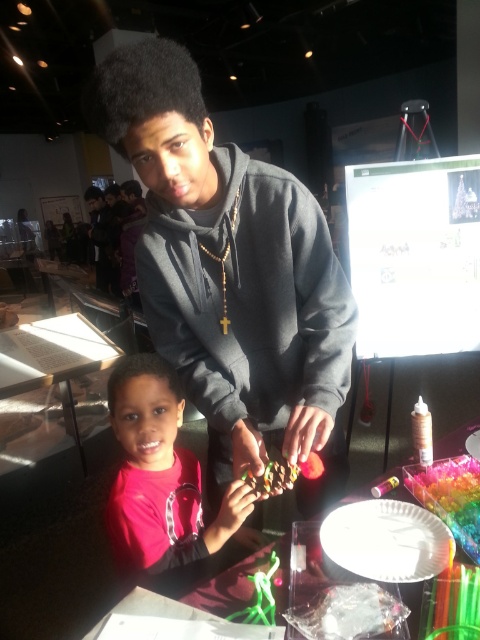
Can you confirm if translucent plastic beads at lower right is shorter than shiny chocolate at lower center?

No.

Is translucent plastic beads at lower right positioned at the back of shiny chocolate at lower center?

No, it is not.

Is point (460, 458) positioned behind point (268, 483)?

Yes, point (460, 458) is behind point (268, 483).

Where is `translucent plastic beads at lower right`? The width and height of the screenshot is (480, 640). translucent plastic beads at lower right is located at coordinates click(x=451, y=497).

Which is behind, point (180, 289) or point (68, 316)?

The point (68, 316) is behind.

Between dark gray hoodie at upper center and transparent glass table at lower left, which one appears on the left side from the viewer's perspective?

From the viewer's perspective, transparent glass table at lower left appears more on the left side.

Locate an element on the screen. This screenshot has width=480, height=640. dark gray hoodie at upper center is located at coordinates (249, 298).

Is transparent glass table at lower left thinner than smooth plastic table at center?

Yes.

Which is more to the right, transparent glass table at lower left or smooth plastic table at center?

smooth plastic table at center

The height and width of the screenshot is (640, 480). What do you see at coordinates (54, 358) in the screenshot? I see `transparent glass table at lower left` at bounding box center [54, 358].

This screenshot has height=640, width=480. Identify the location of transparent glass table at lower left. (54, 358).